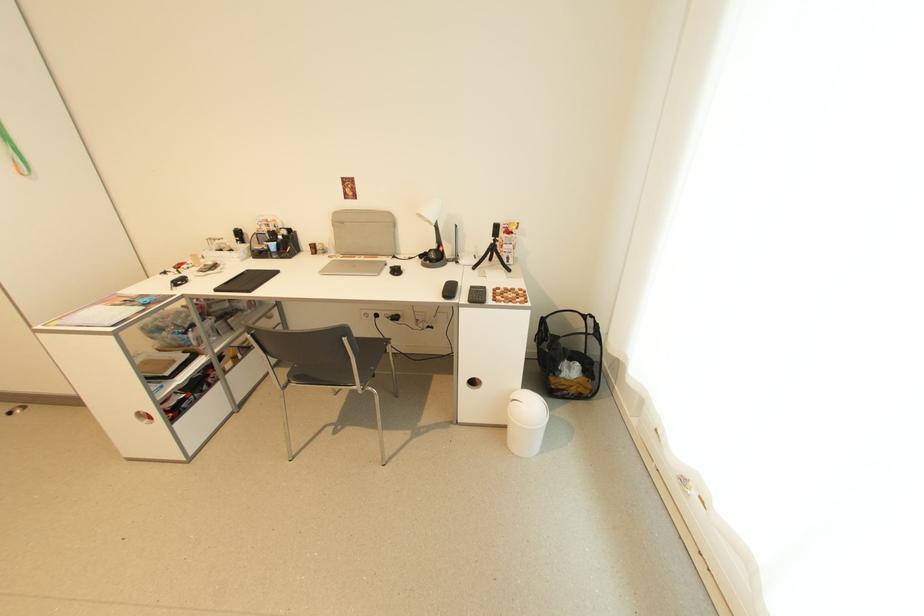
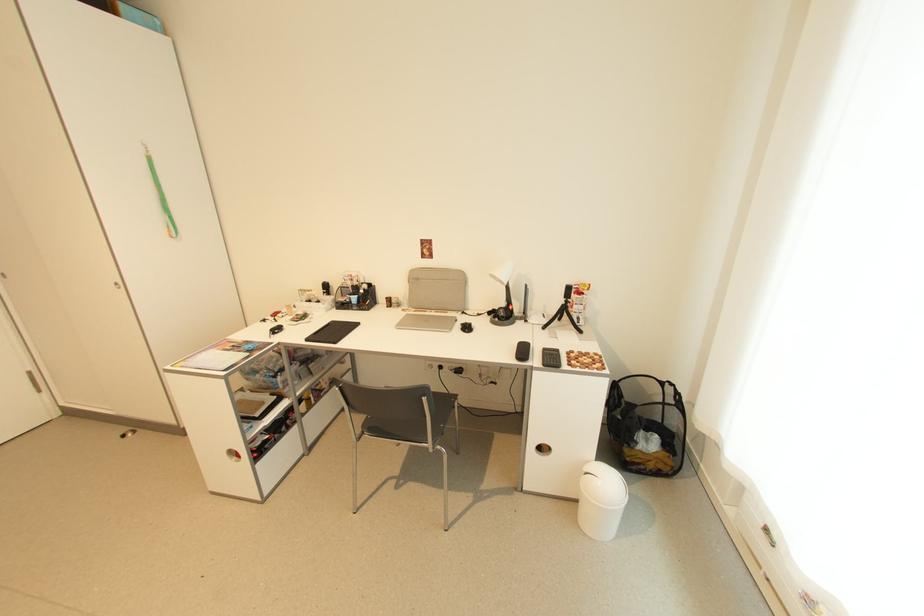
In the second image, find the point that corresponds to the point at 439,248 in the first image.

(507, 306)